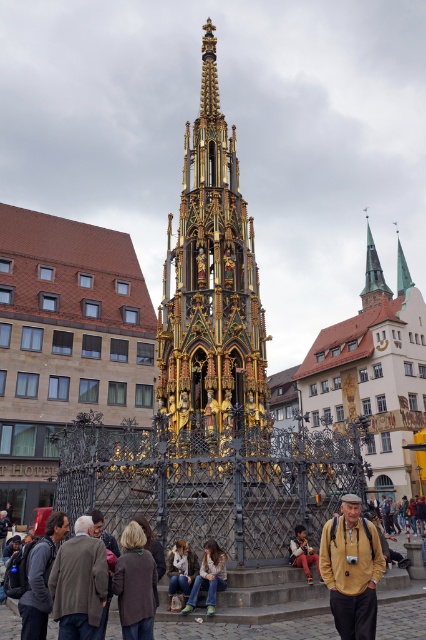
Question: From the image, what is the correct spatial relationship of gold/gilded metal tower at center in relation to white fur dog at center?

Choices:
 (A) below
 (B) above

Answer: (B)

Question: Which point is closer to the camera?

Choices:
 (A) (132, 579)
 (B) (299, 531)
 (C) (400, 285)

Answer: (A)

Question: Considering the relative positions of yellow cotton jacket at lower right and green copper spire at upper right in the image provided, where is yellow cotton jacket at lower right located with respect to green copper spire at upper right?

Choices:
 (A) below
 (B) above

Answer: (A)

Question: Which point appears closest to the camera in this image?

Choices:
 (A) (112, 563)
 (B) (299, 384)
 (C) (86, 612)
 (D) (189, 608)

Answer: (C)

Question: Which point is farther to the camera?

Choices:
 (A) green copper spire at upper right
 (B) yellow cotton jacket at lower right
 (C) brown leather jacket at lower left

Answer: (A)

Question: Does leather jacket at lower right have a greater width compared to green copper spire at upper right?

Choices:
 (A) no
 (B) yes

Answer: (A)